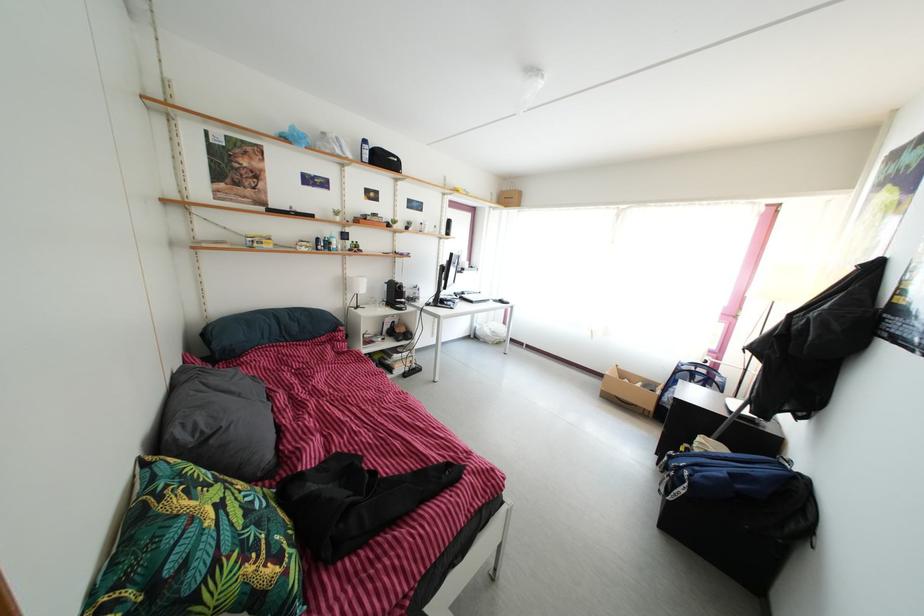
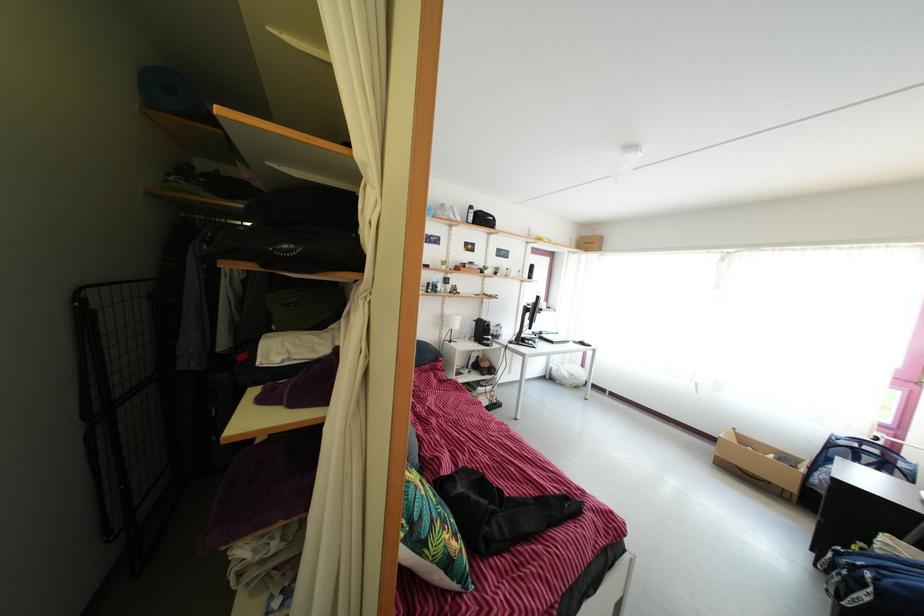
The point at (x=672, y=408) is marked in the first image. Where is the corresponding point in the second image?

(821, 488)